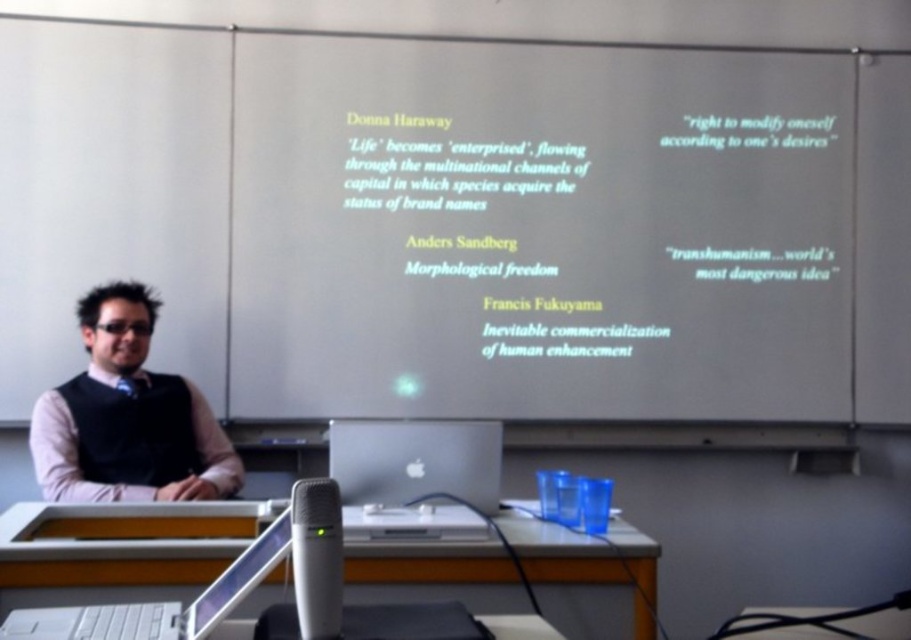
Question: Where is white plastic laptop at lower center located in relation to white plastic microphone at center in the image?

Choices:
 (A) left
 (B) right

Answer: (A)

Question: Is orange plastic table at lower center to the left of transparent plastic screen at lower center from the viewer's perspective?

Choices:
 (A) yes
 (B) no

Answer: (B)

Question: Which object is the farthest from the matte black vest at left?

Choices:
 (A) silver metallic computer at center
 (B) white plastic microphone at center

Answer: (B)

Question: Does orange plastic table at lower center have a greater width compared to white plastic microphone at center?

Choices:
 (A) yes
 (B) no

Answer: (A)

Question: Which point is farther to the camera?

Choices:
 (A) matte black vest at left
 (B) white paper at upper center
 (C) transparent plastic screen at lower center

Answer: (B)

Question: Which object appears closest to the camera in this image?

Choices:
 (A) white plastic microphone at center
 (B) transparent plastic screen at lower center

Answer: (A)